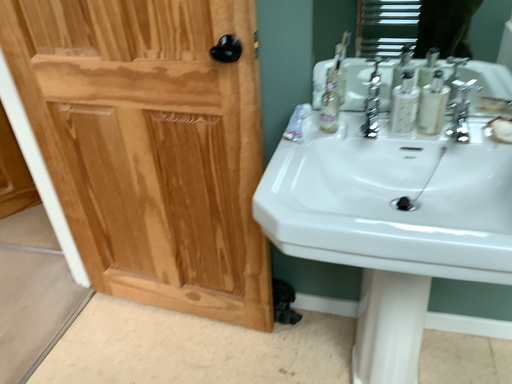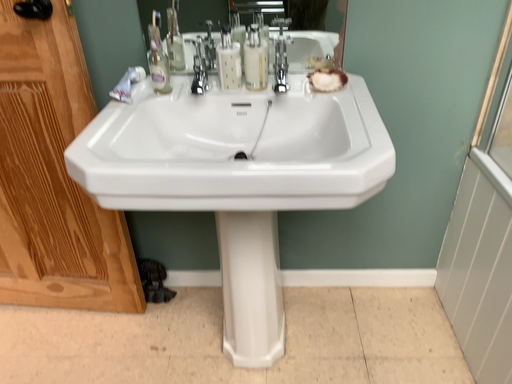
Question: How did the camera likely rotate when shooting the video?

Choices:
 (A) rotated left
 (B) rotated right

Answer: (B)